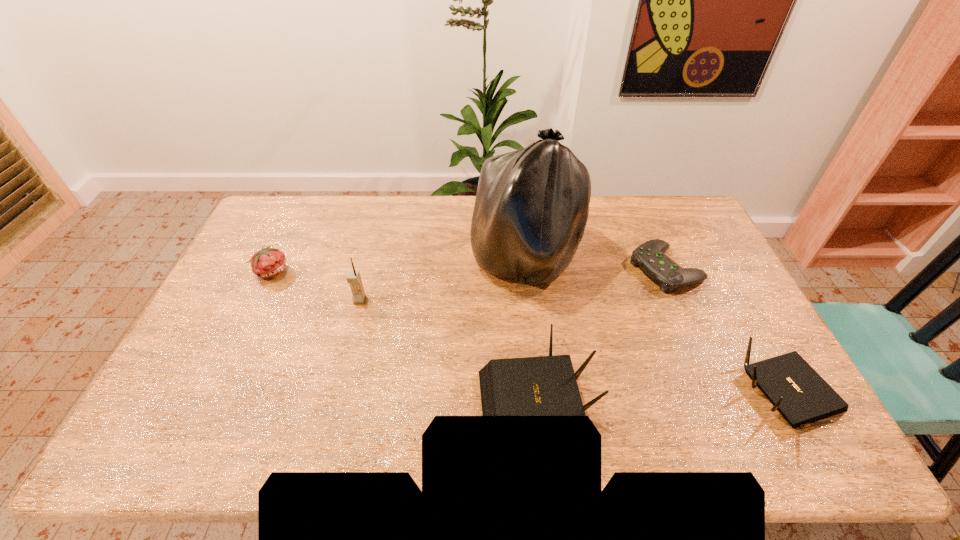
Where is `free point between the second shortest object and the fifth shortest object`? free point between the second shortest object and the fifth shortest object is located at coordinates (316, 285).

Identify the location of vacant space in between the right router and the tallest object. (658, 328).

Locate an element on the screen. The image size is (960, 540). vacant area that lies between the plastic bag and the control is located at coordinates (596, 264).

Find the location of a particular element. The image size is (960, 540). vacant space in between the taller router and the fifth shortest object is located at coordinates (448, 352).

The height and width of the screenshot is (540, 960). I want to click on free space between the left router and the second tallest object, so click(x=448, y=352).

At what (x,y) coordinates should I click in order to perform the action: click on vacant space in between the tallest object and the cellular telephone. Please return your answer as a coordinate pair (x, y). The image size is (960, 540). Looking at the image, I should click on (444, 280).

Find the location of a particular element. This screenshot has width=960, height=540. free spot between the right router and the fifth object from right to left is located at coordinates (574, 348).

Choose which object is the fourth nearest neighbor to the left router. Please provide its 2D coordinates. Your answer should be formatted as a tuple, i.e. [(x, y)], where the tuple contains the x and y coordinates of a point satisfying the conditions above.

[(353, 277)]

Identify which object is the fourth closest to the plastic bag. Please provide its 2D coordinates. Your answer should be formatted as a tuple, i.e. [(x, y)], where the tuple contains the x and y coordinates of a point satisfying the conditions above.

[(796, 390)]

The image size is (960, 540). I want to click on vacant area in the image that satisfies the following two spatial constraints: 1. on the front of the third tallest object, where the keypad is located; 2. on the left side of the fifth object from right to left, so click(333, 403).